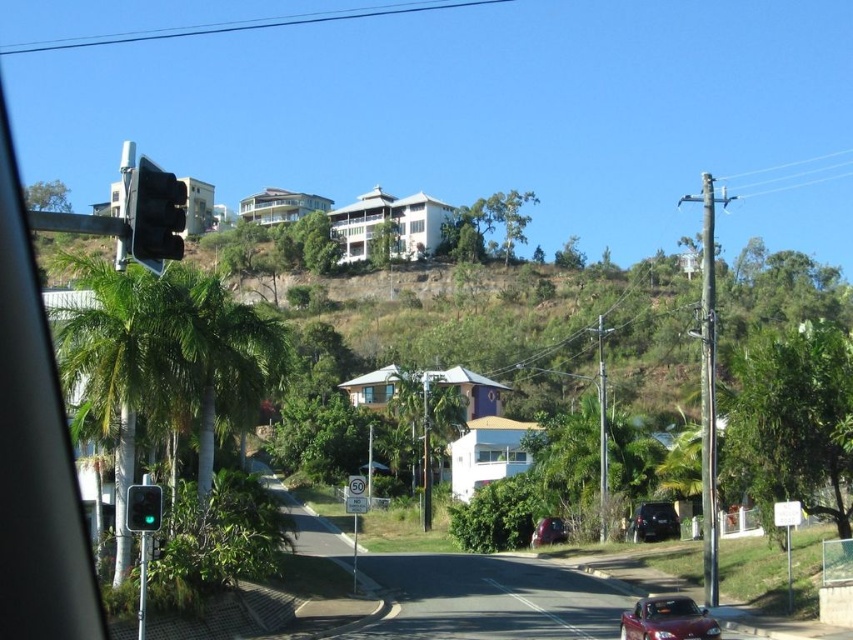
Can you confirm if shiny maroon car at lower right is bigger than shiny black sedan at lower right?

Correct, shiny maroon car at lower right is larger in size than shiny black sedan at lower right.

Does shiny maroon car at lower right appear on the right side of shiny black sedan at lower right?

Incorrect, shiny maroon car at lower right is not on the right side of shiny black sedan at lower right.

Between point (704, 616) and point (660, 524), which one is positioned in front?

Point (704, 616)

Locate an element on the screen. shiny maroon car at lower right is located at coordinates (666, 620).

Does green glass traffic light at left have a greater width compared to metallic red car at center?

No.

Does green glass traffic light at left have a greater height compared to metallic red car at center?

Incorrect, green glass traffic light at left's height is not larger of metallic red car at center's.

Describe the element at coordinates (143, 508) in the screenshot. The width and height of the screenshot is (853, 640). I see `green glass traffic light at left` at that location.

Where is `green glass traffic light at left`? green glass traffic light at left is located at coordinates (143, 508).

Is shiny black sedan at lower right closer to the viewer compared to metallic red car at center?

Yes.

Which is behind, point (657, 536) or point (538, 545)?

The point (538, 545) is more distant.

The height and width of the screenshot is (640, 853). In order to click on shiny black sedan at lower right in this screenshot , I will do `click(654, 522)`.

Identify the location of shiny black sedan at lower right. The image size is (853, 640). (654, 522).